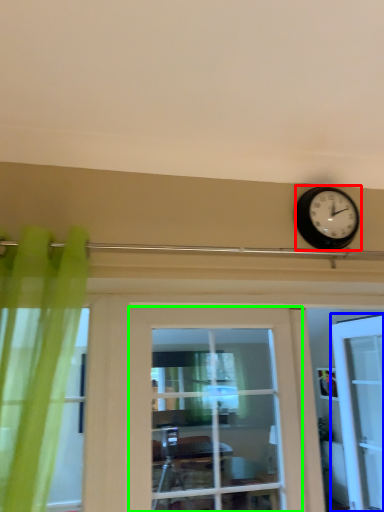
Question: Which object is positioned closest to wall clock (highlighted by a red box)? Select from door (highlighted by a blue box) and door (highlighted by a green box).

Choices:
 (A) door
 (B) door

Answer: (B)